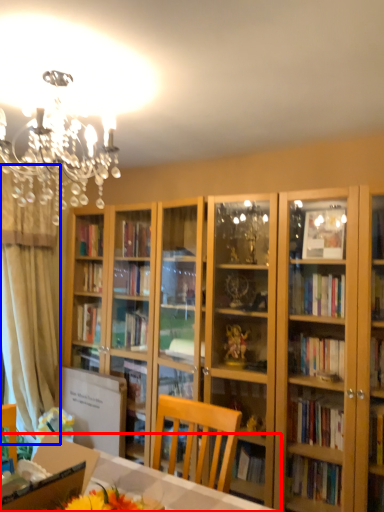
Question: Which of the following is the farthest to the observer, desk (highlighted by a red box) or curtain (highlighted by a blue box)?

Choices:
 (A) desk
 (B) curtain

Answer: (B)